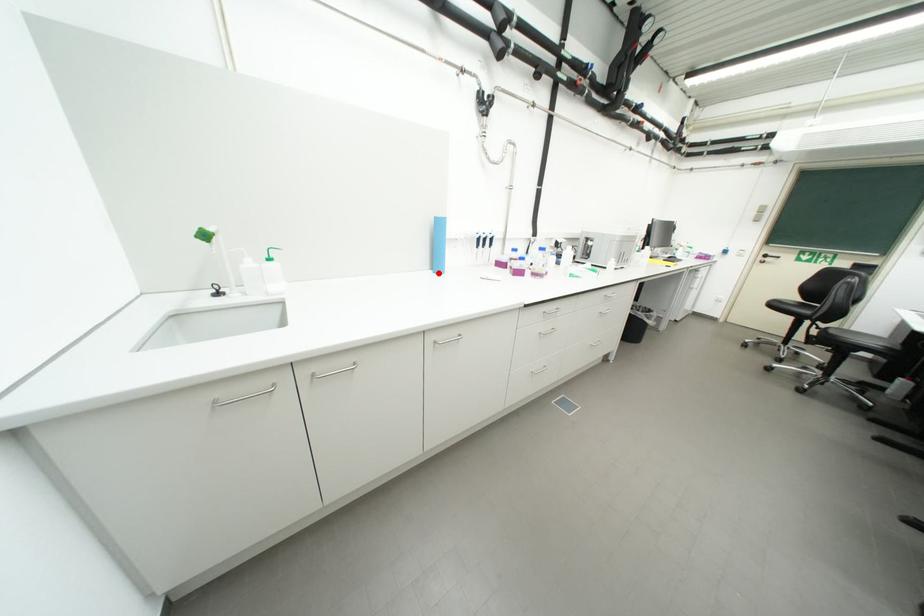
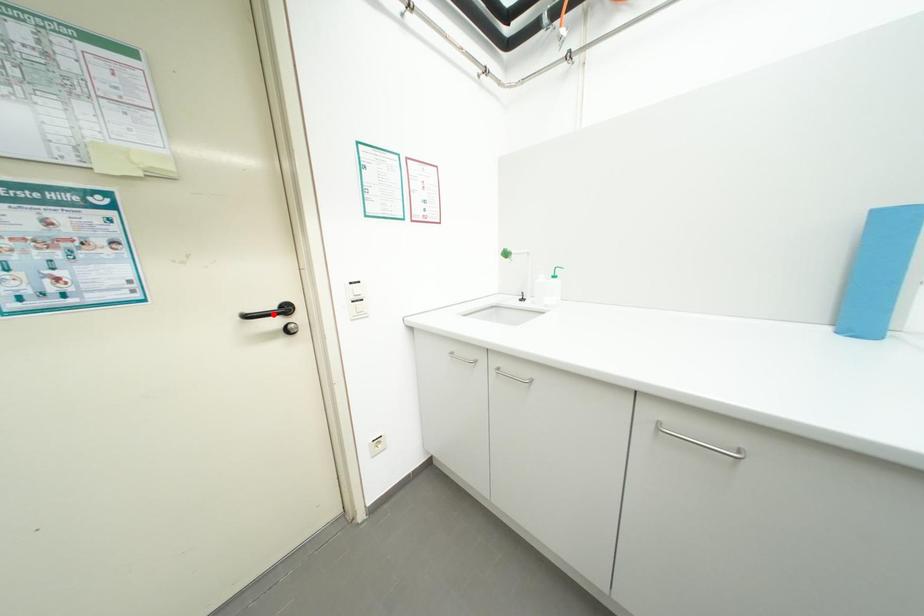
I am providing you with two images of the same scene from different viewpoints. A red point is marked on the first image and another point is marked on the second image. Does the point marked in image1 correspond to the same location as the one in image2?

No